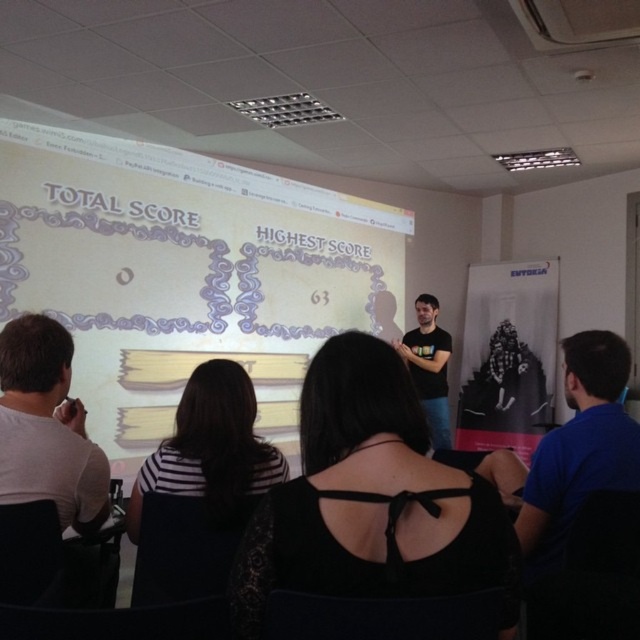
Question: Can you confirm if black lace dress at center is smaller than black t-shirt at center?

Choices:
 (A) no
 (B) yes

Answer: (B)

Question: Does white glossy projection screen at upper center appear under black t-shirt at center?

Choices:
 (A) yes
 (B) no

Answer: (B)

Question: From the image, what is the correct spatial relationship of black striped shirt at center in relation to black t-shirt at center?

Choices:
 (A) left
 (B) right

Answer: (A)

Question: Based on their relative distances, which object is nearer to the blue t-shirt at right?

Choices:
 (A) white glossy projection screen at upper center
 (B) matte white shirt at left
 (C) black lace dress at center

Answer: (C)

Question: Which point is farther to the camera?

Choices:
 (A) blue t-shirt at right
 (B) matte white shirt at left
 (C) white glossy projection screen at upper center
 (D) black t-shirt at center

Answer: (D)

Question: Which object appears closest to the camera in this image?

Choices:
 (A) blue t-shirt at right
 (B) black lace dress at center

Answer: (B)